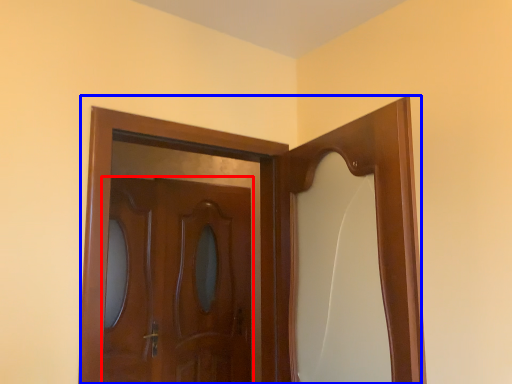
Question: Which of the following is the farthest to the observer, door (highlighted by a red box) or door (highlighted by a blue box)?

Choices:
 (A) door
 (B) door

Answer: (A)